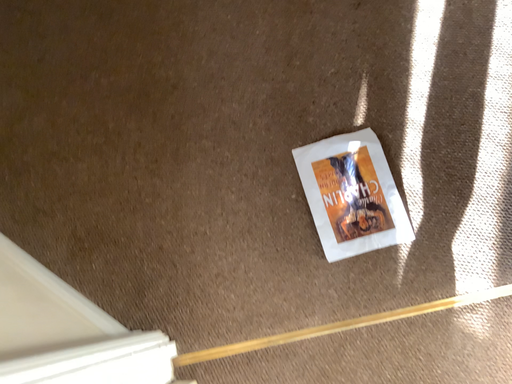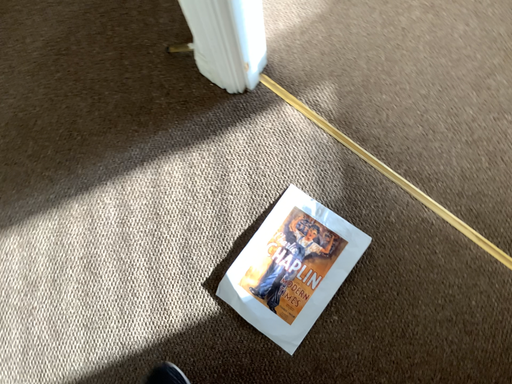
Question: Which way did the camera rotate in the video?

Choices:
 (A) rotated upward
 (B) rotated downward

Answer: (A)